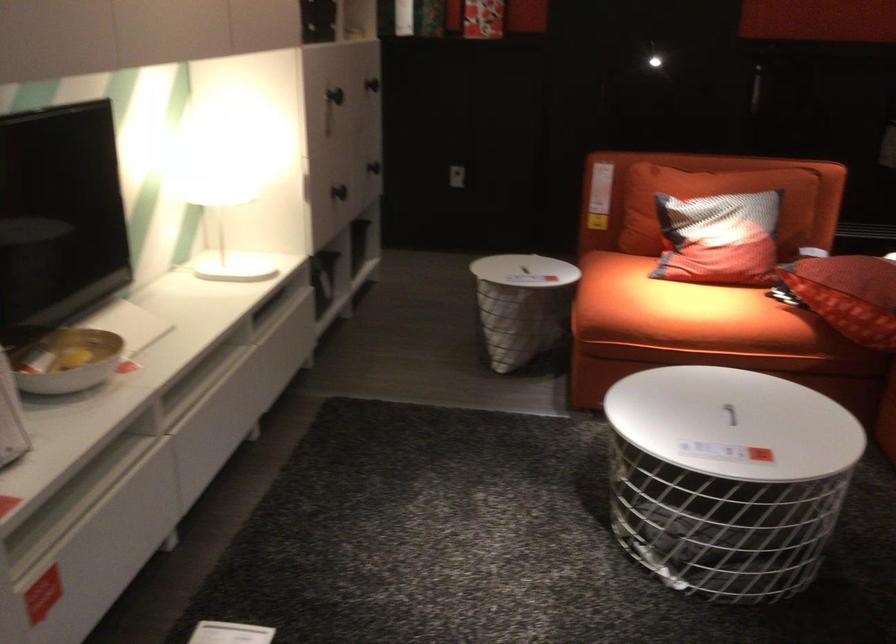
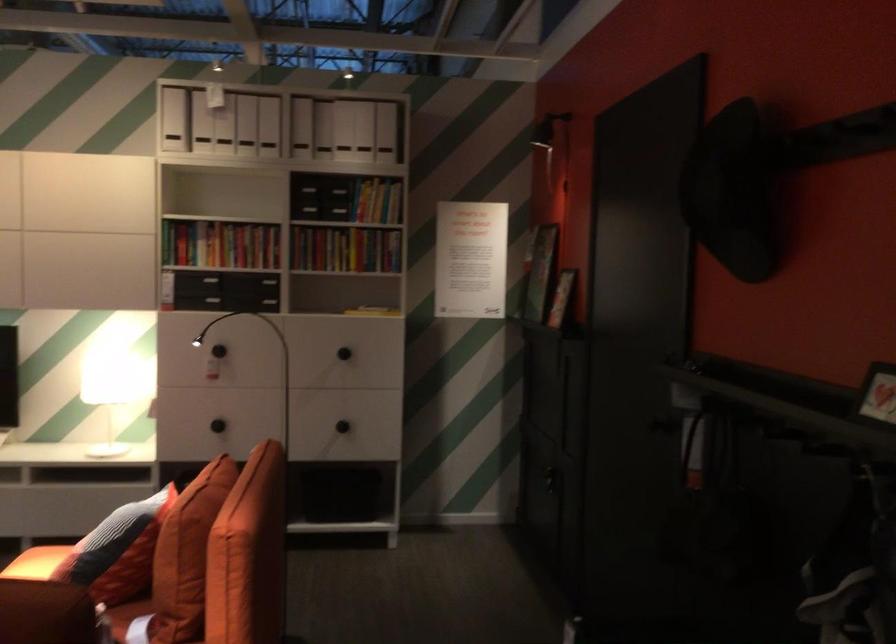
Question: I am providing you with two images of the same scene from different viewpoints. After the viewpoint changes to image2, which objects are now occluded?

Choices:
 (A) table lid handle
 (B) white magazine file
 (C) paper with clip
 (D) black hat

Answer: (A)